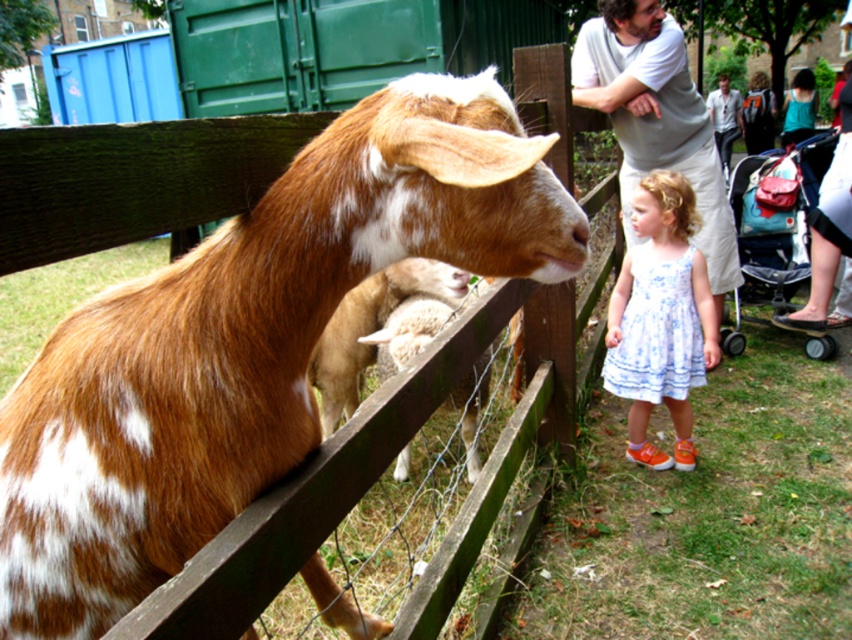
Question: Which object is closer to the camera taking this photo?

Choices:
 (A) white floral dress at center
 (B) brown speckled fur at left

Answer: (B)

Question: Can you confirm if brown speckled fur at left is wider than white floral dress at center?

Choices:
 (A) no
 (B) yes

Answer: (B)

Question: Considering the relative positions of brown speckled fur at left and white floral dress at center in the image provided, where is brown speckled fur at left located with respect to white floral dress at center?

Choices:
 (A) above
 (B) below

Answer: (B)

Question: In this image, where is brown speckled fur at left located relative to white floral dress at center?

Choices:
 (A) above
 (B) below

Answer: (B)

Question: Among these points, which one is nearest to the camera?

Choices:
 (A) (398, 244)
 (B) (636, 209)

Answer: (A)